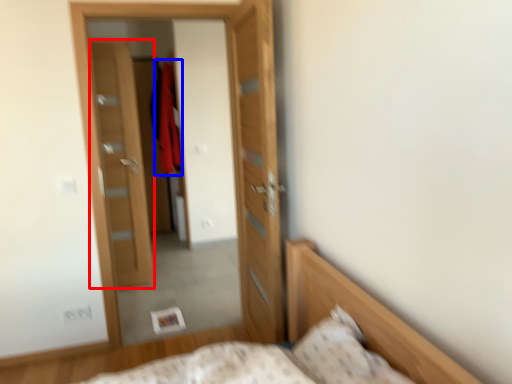
Question: Which of the following is the farthest to the observer, door (highlighted by a red box) or robe (highlighted by a blue box)?

Choices:
 (A) door
 (B) robe

Answer: (B)